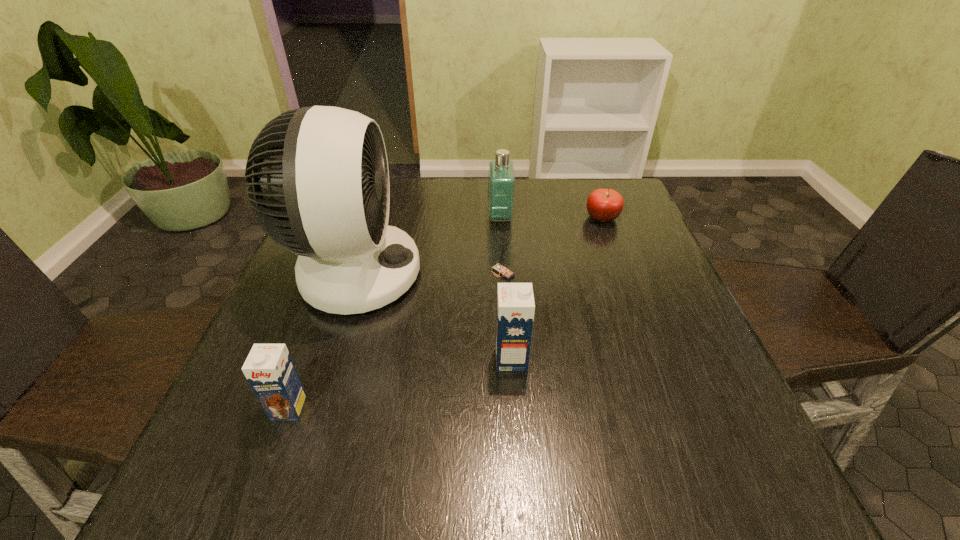
Locate an element on the screen. object that is at the right edge is located at coordinates (604, 205).

Locate an element on the screen. The height and width of the screenshot is (540, 960). object situated at the near left corner is located at coordinates (269, 369).

This screenshot has width=960, height=540. What are the coordinates of `object that is positioned at the far right corner` in the screenshot? It's located at (604, 205).

In the image, there is a desktop. Where is `free region at the far edge`? Image resolution: width=960 pixels, height=540 pixels. free region at the far edge is located at coordinates (530, 198).

Where is `free spot at the near edge of the desktop`? The width and height of the screenshot is (960, 540). free spot at the near edge of the desktop is located at coordinates (645, 430).

I want to click on free region at the left edge of the desktop, so click(273, 334).

In the image, there is a desktop. Where is `vacant space at the right edge`? This screenshot has height=540, width=960. vacant space at the right edge is located at coordinates (615, 319).

This screenshot has width=960, height=540. I want to click on free space that is in between the rightmost object and the perfume, so click(551, 217).

Where is `vacant space in between the tallest object and the apple`? vacant space in between the tallest object and the apple is located at coordinates (478, 246).

Locate an element on the screen. free point between the farther chocolate milk and the tallest object is located at coordinates (433, 316).